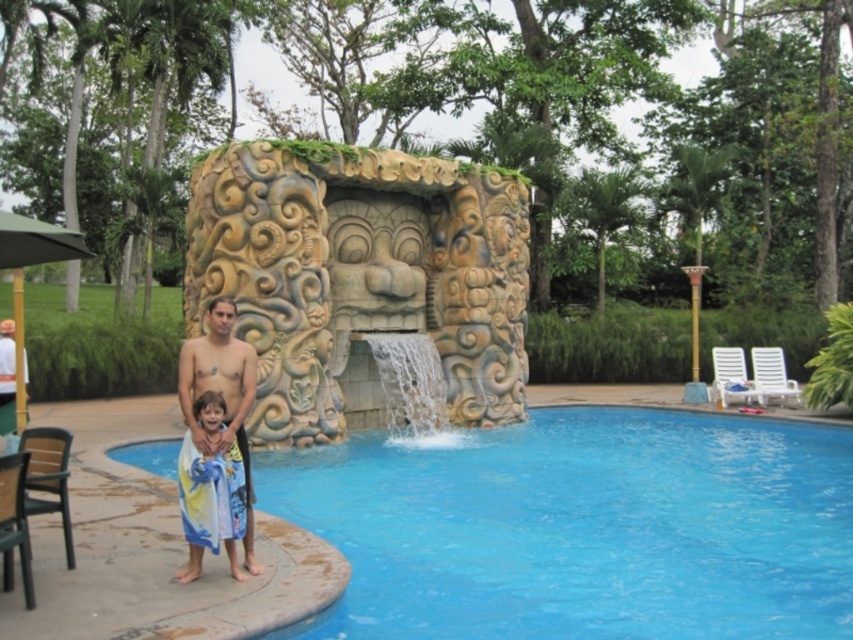
Question: Observing the image, what is the correct spatial positioning of blue glossy swimming pool at lower center in reference to smooth tan towel at center?

Choices:
 (A) above
 (B) below

Answer: (B)

Question: Among these points, which one is farthest from the camera?

Choices:
 (A) (7, 410)
 (B) (624, 616)

Answer: (A)

Question: Which object is the farthest from the smooth tan towel at center?

Choices:
 (A) blue glossy swimming pool at lower center
 (B) smooth tan skin at left

Answer: (B)

Question: Which point is closer to the camera taking this photo?

Choices:
 (A) (190, 428)
 (B) (440, 586)

Answer: (A)

Question: Is blue glossy swimming pool at lower center to the left of smooth tan skin at left from the viewer's perspective?

Choices:
 (A) yes
 (B) no

Answer: (B)

Question: Is blue glossy swimming pool at lower center positioned in front of smooth tan towel at center?

Choices:
 (A) yes
 (B) no

Answer: (A)